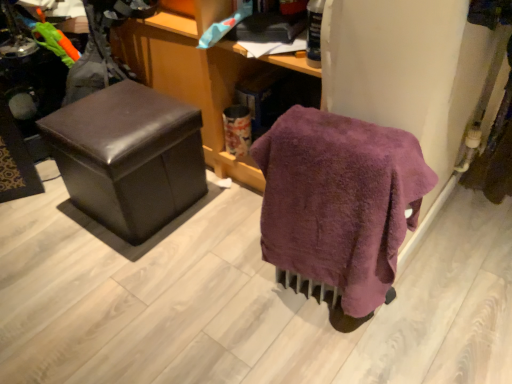
The width and height of the screenshot is (512, 384). I want to click on blank space situated above matte brown ottoman at left (from a real-world perspective), so click(x=100, y=119).